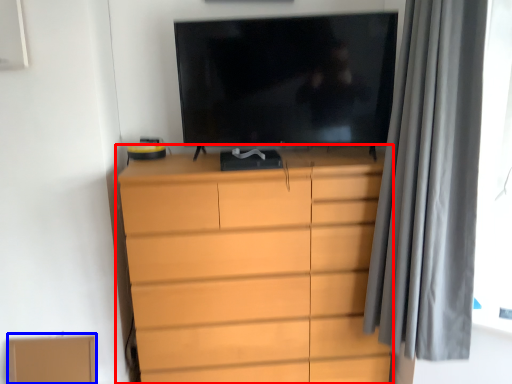
Question: Among these objects, which one is nearest to the camera, chest of drawers (highlighted by a red box) or cardboard box (highlighted by a blue box)?

Choices:
 (A) chest of drawers
 (B) cardboard box

Answer: (A)